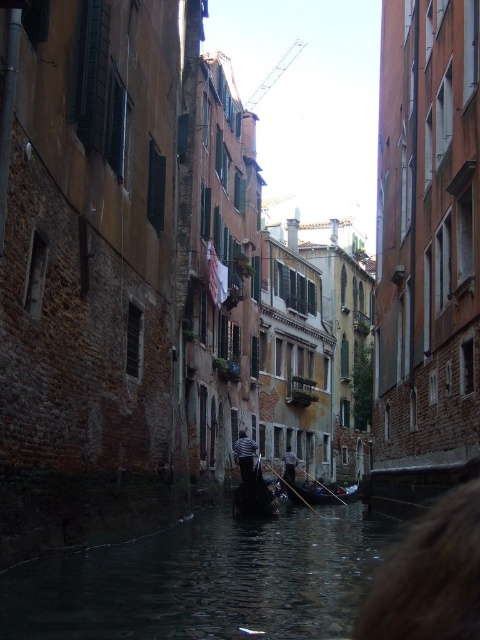
Question: Does striped shirt at center appear over dark gray fabric shirt at center?

Choices:
 (A) yes
 (B) no

Answer: (A)

Question: Which of the following is the closest to the observer?

Choices:
 (A) (291, 461)
 (B) (253, 444)

Answer: (B)

Question: Is wooden gondola at center to the right of striped shirt at center from the viewer's perspective?

Choices:
 (A) yes
 (B) no

Answer: (A)

Question: Which object appears closest to the camera in this image?

Choices:
 (A) wooden gondola at center
 (B) dark gray fabric shirt at center
 (C) striped shirt at center

Answer: (A)

Question: Is the position of dark water at center more distant than that of wooden gondola at center?

Choices:
 (A) yes
 (B) no

Answer: (B)

Question: Which object is the closest to the wooden gondola at center?

Choices:
 (A) striped shirt at center
 (B) dark water at center

Answer: (A)